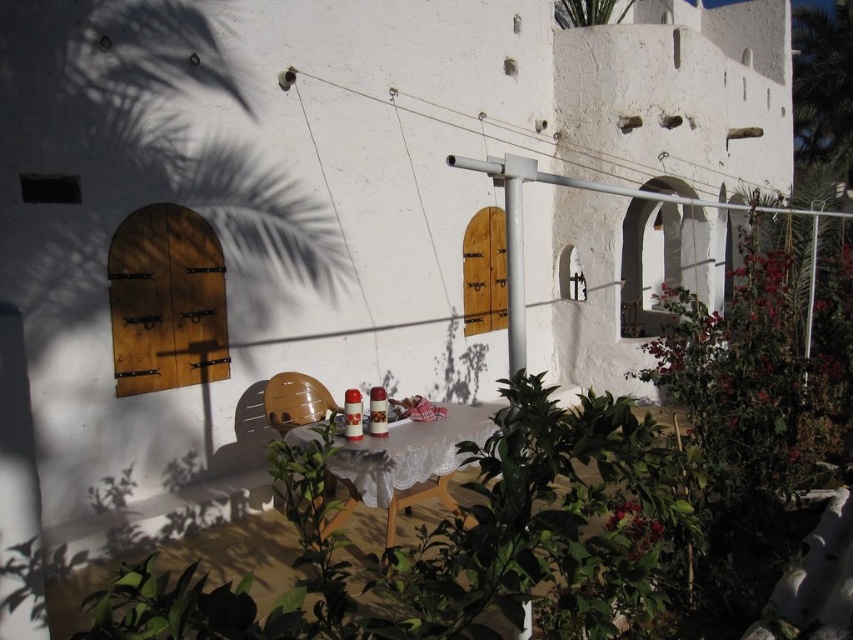
Who is lower down, white lace tablecloth at center or green leafy plant at upper center?

white lace tablecloth at center is below.

Which is in front, point (393, 515) or point (619, 1)?

Point (393, 515) is in front.

Where is `white lace tablecloth at center`? The height and width of the screenshot is (640, 853). white lace tablecloth at center is located at coordinates (405, 465).